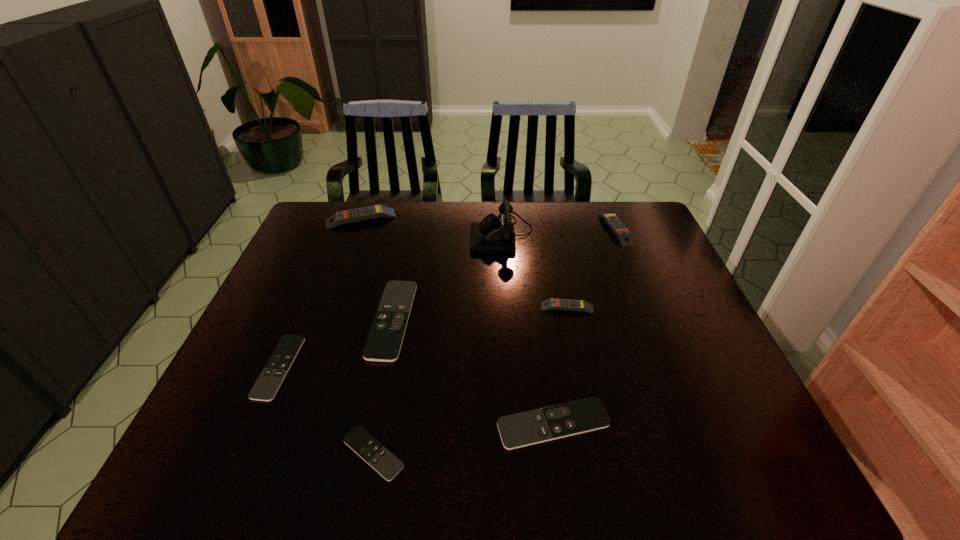
You are a GUI agent. You are given a task and a screenshot of the screen. Output one action in this format:
    pyautogui.click(x=<x>, y=<y>)
    Task: Click on the free location at the near edge of the desktop
    This screenshot has height=540, width=960.
    Given the screenshot: What is the action you would take?
    pyautogui.click(x=646, y=479)

You are a GUI agent. You are given a task and a screenshot of the screen. Output one action in this format:
    pyautogui.click(x=<x>, y=<y>)
    Task: Click on the vacant space at the left edge
    The image size is (960, 540).
    Given the screenshot: What is the action you would take?
    pyautogui.click(x=306, y=253)

Identify the location of vacant space at the right edge. The height and width of the screenshot is (540, 960). [x=670, y=320].

Identify the location of free space at the far left corner. The height and width of the screenshot is (540, 960). (354, 207).

The width and height of the screenshot is (960, 540). In the image, there is a desktop. In order to click on vacant space at the far right corner in this screenshot , I will do `click(642, 208)`.

The width and height of the screenshot is (960, 540). In order to click on vacant region at the near right corner in this screenshot , I will do `click(712, 462)`.

The width and height of the screenshot is (960, 540). I want to click on free space that is in between the smallest yellow remote control and the third smallest black remote control, so click(x=561, y=366).

The height and width of the screenshot is (540, 960). I want to click on free spot between the third smallest black remote control and the tallest object, so click(x=528, y=329).

Identify the location of unoccupied position between the fifth tallest remote control and the second smallest black remote control. The height and width of the screenshot is (540, 960). (416, 396).

Locate an element on the screen. The image size is (960, 540). free spot between the tallest object and the rightmost black remote control is located at coordinates (528, 329).